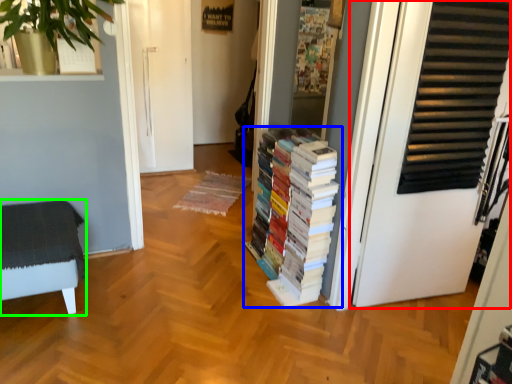
Question: Estimate the real-world distances between objects in this image. Which object is closer to door (highlighted by a red box), book (highlighted by a blue box) or furniture (highlighted by a green box)?

Choices:
 (A) book
 (B) furniture

Answer: (A)